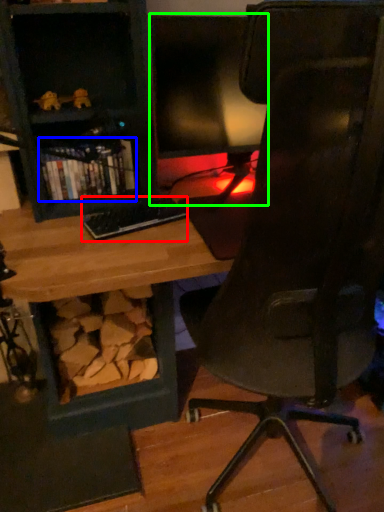
Question: Which is farther away from keyboard (highlighted by a red box)? book (highlighted by a blue box) or computer monitor (highlighted by a green box)?

Choices:
 (A) book
 (B) computer monitor

Answer: (B)